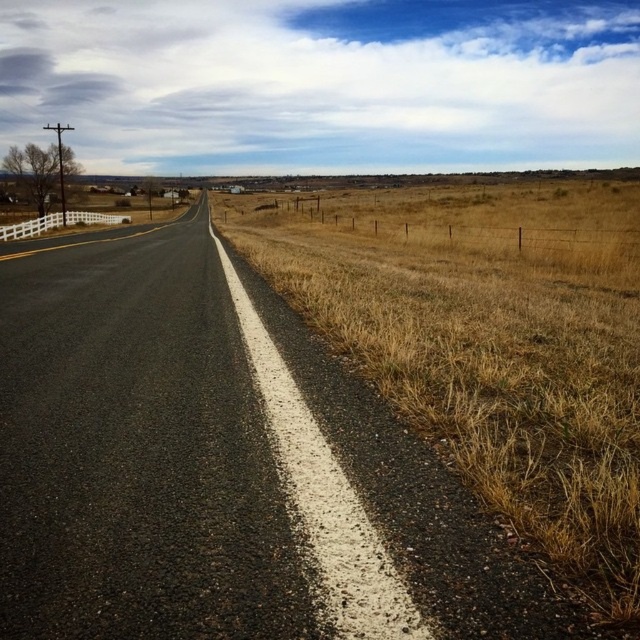
Question: Observing the image, what is the correct spatial positioning of black asphalt road at center in reference to dry grass at right?

Choices:
 (A) left
 (B) right

Answer: (A)

Question: Is black asphalt road at center below dry grass at right?

Choices:
 (A) yes
 (B) no

Answer: (A)

Question: Which point is closer to the camera?

Choices:
 (A) 541,237
 (B) 3,426

Answer: (B)

Question: Can you confirm if black asphalt road at center is thinner than dry grass at right?

Choices:
 (A) yes
 (B) no

Answer: (A)